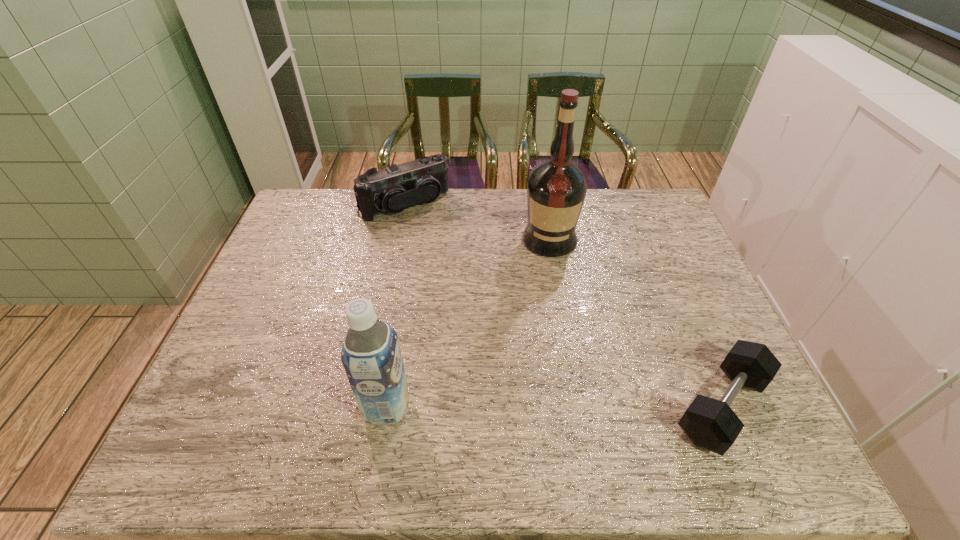
Identify the location of free space between the soya milk and the camcorder. The width and height of the screenshot is (960, 540). (396, 306).

The width and height of the screenshot is (960, 540). Find the location of `free spot between the third tallest object and the shortest object`. free spot between the third tallest object and the shortest object is located at coordinates (564, 306).

Locate an element on the screen. Image resolution: width=960 pixels, height=540 pixels. empty location between the third tallest object and the dumbbell is located at coordinates (564, 306).

Where is `empty space that is in between the rightmost object and the tallest object`? Image resolution: width=960 pixels, height=540 pixels. empty space that is in between the rightmost object and the tallest object is located at coordinates (636, 323).

The width and height of the screenshot is (960, 540). Find the location of `free area in between the second tallest object and the third tallest object`. free area in between the second tallest object and the third tallest object is located at coordinates (396, 306).

Locate an element on the screen. The image size is (960, 540). vacant region between the rightmost object and the liquor is located at coordinates (636, 323).

Image resolution: width=960 pixels, height=540 pixels. Identify the location of empty space that is in between the third tallest object and the tallest object. (477, 222).

Identify the location of unoccupied area between the third tallest object and the rightmost object. (564, 306).

Find the location of a particular element. Image resolution: width=960 pixels, height=540 pixels. object that stands as the third closest to the rightmost object is located at coordinates (x=390, y=190).

Select which object is the second closest to the third tallest object. Please provide its 2D coordinates. Your answer should be formatted as a tuple, i.e. [(x, y)], where the tuple contains the x and y coordinates of a point satisfying the conditions above.

[(371, 356)]